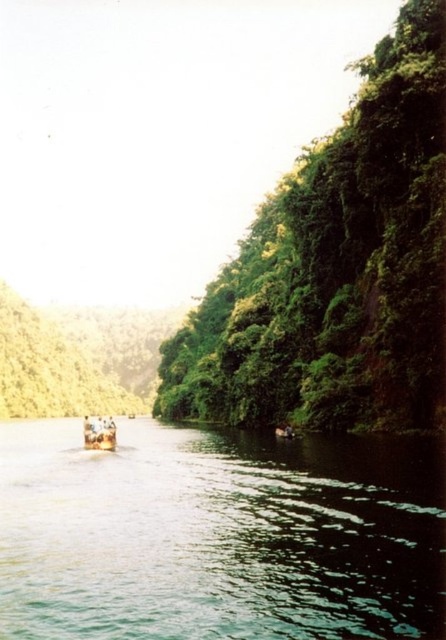
Can you confirm if green glossy water at center is smaller than green leafy tree at center?

Indeed, green glossy water at center has a smaller size compared to green leafy tree at center.

Is green glossy water at center further to the viewer compared to green leafy tree at center?

No, green glossy water at center is closer to the viewer.

This screenshot has height=640, width=446. What do you see at coordinates (218, 536) in the screenshot?
I see `green glossy water at center` at bounding box center [218, 536].

I want to click on green glossy water at center, so click(218, 536).

Does green leafy tree at center appear on the left side of wooden boat at lower left?

Correct, you'll find green leafy tree at center to the left of wooden boat at lower left.

I want to click on green leafy tree at center, so click(x=50, y=369).

Where is `green leafy tree at center`? green leafy tree at center is located at coordinates (50, 369).

Does green leafy trees at right appear on the right side of wooden boat at lower left?

Correct, you'll find green leafy trees at right to the right of wooden boat at lower left.

Which is more to the left, green leafy trees at right or wooden boat at lower left?

From the viewer's perspective, wooden boat at lower left appears more on the left side.

At what (x,y) coordinates should I click in order to perform the action: click on green leafy trees at right. Please return your answer as a coordinate pair (x, y). Looking at the image, I should click on (337, 268).